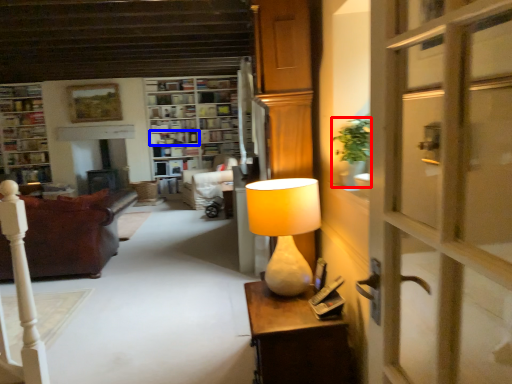
Question: Which object appears closest to the camera in this image, houseplant (highlighted by a red box) or shelf (highlighted by a blue box)?

Choices:
 (A) houseplant
 (B) shelf

Answer: (A)